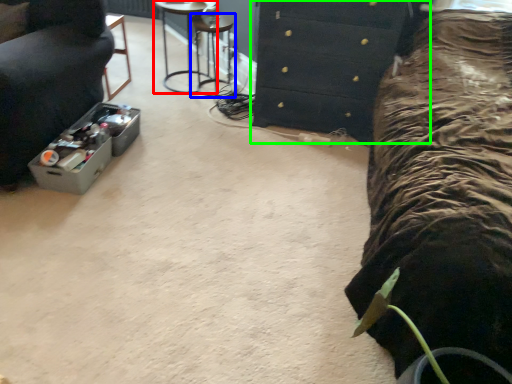
Question: Which is nearer to the furniture (highlighted by a red box)? bar stool (highlighted by a blue box) or chest of drawers (highlighted by a green box).

Choices:
 (A) bar stool
 (B) chest of drawers

Answer: (A)